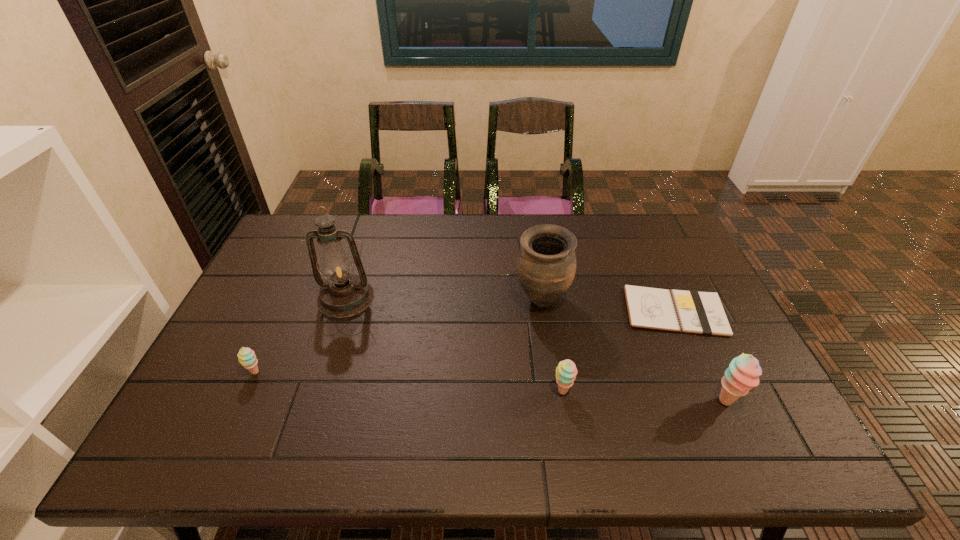
Find the location of `location for an additional sherbert to make spacing equal`. location for an additional sherbert to make spacing equal is located at coordinates pos(406,381).